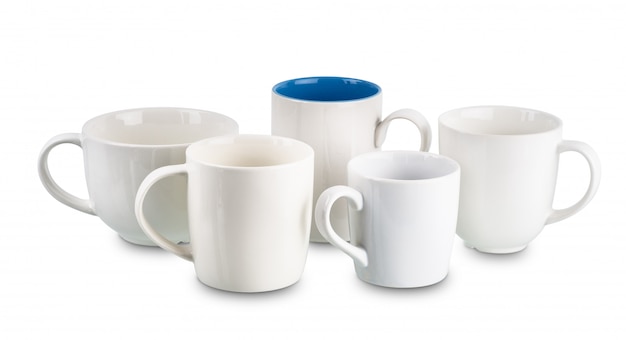
Locate an element on the screen. The width and height of the screenshot is (626, 340). coffee mug is located at coordinates (501, 176), (408, 215), (274, 212), (126, 163), (326, 134).